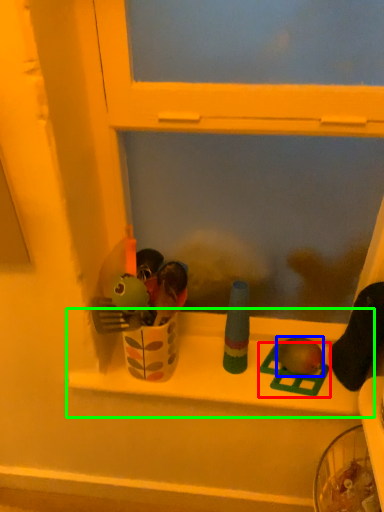
Question: Considering the real-world distances, which object is farthest from toy (highlighted by a red box)? toy (highlighted by a blue box) or window sill (highlighted by a green box)?

Choices:
 (A) toy
 (B) window sill

Answer: (B)